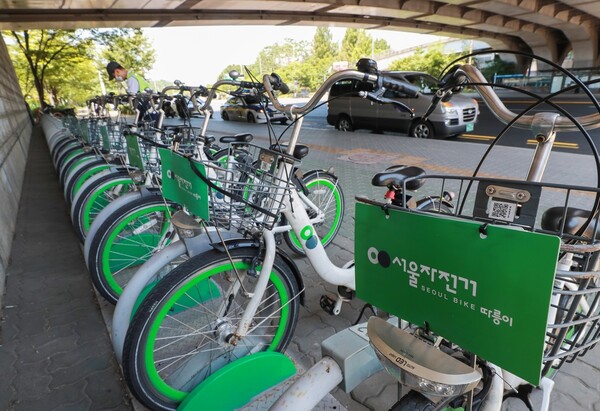
Identify the location of seats. This screenshot has height=411, width=600. (573, 224), (404, 182), (277, 146), (241, 137), (172, 127).